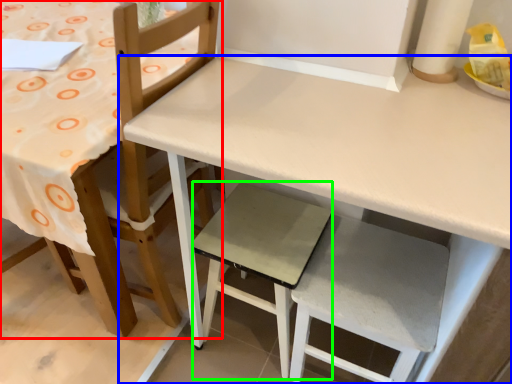
Question: Estimate the real-world distances between objects in this image. Which object is farther from chair (highlighted by a red box), table (highlighted by a blue box) or step stool (highlighted by a green box)?

Choices:
 (A) table
 (B) step stool

Answer: (A)